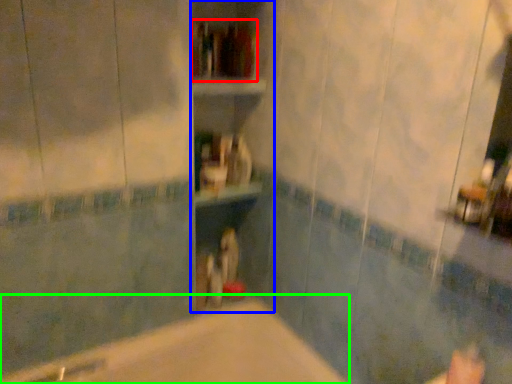
Question: Which object is positioned closest to book (highlighted by a red box)? Select from bookshelf (highlighted by a blue box) and bathtub (highlighted by a green box).

Choices:
 (A) bookshelf
 (B) bathtub

Answer: (A)